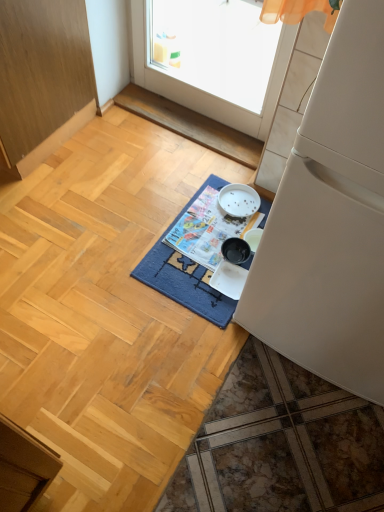
At what (x,y) coordinates should I click in order to perform the action: click on vacant space situated on the left part of blue woven mat at center. Please return your answer as a coordinate pair (x, y). The width and height of the screenshot is (384, 512). Looking at the image, I should click on (96, 226).